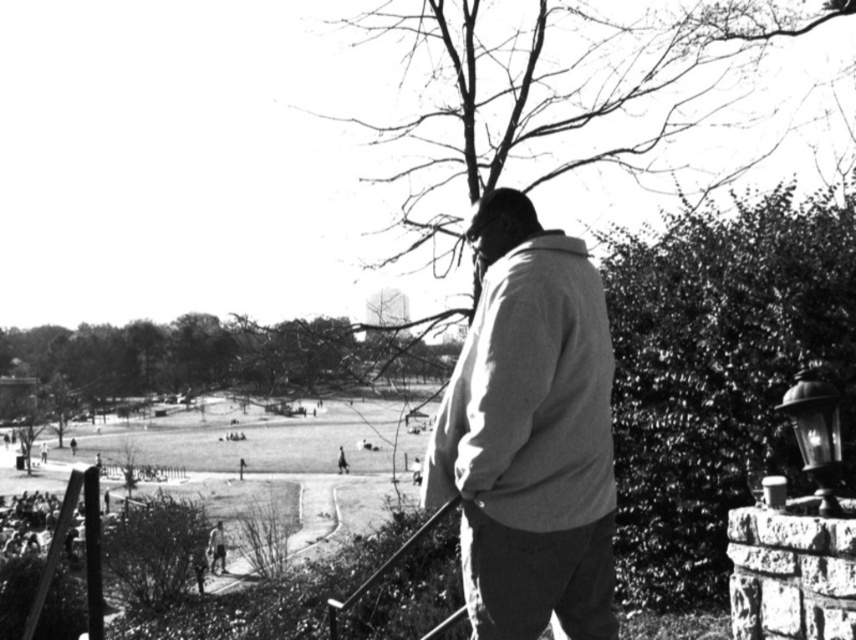
Between point (562, 266) and point (421, 536), which one is positioned in front?

Positioned in front is point (562, 266).

Consider the image. Does light gray cotton jacket at center come in front of smooth metal rail at lower center?

Yes, light gray cotton jacket at center is in front of smooth metal rail at lower center.

Identify the location of light gray cotton jacket at center. The image size is (856, 640). (530, 435).

Can you confirm if smooth metal rail at lower center is smaller than smooth beige jacket at lower center?

Actually, smooth metal rail at lower center might be larger than smooth beige jacket at lower center.

Is point (414, 531) farther from viewer compared to point (223, 532)?

No, it is in front of (223, 532).

Find the location of `smooth metal rail at lower center`. smooth metal rail at lower center is located at coordinates (384, 566).

Which is more to the left, light gray cotton jacket at center or smooth beige jacket at lower center?

smooth beige jacket at lower center is more to the left.

Does light gray cotton jacket at center have a greater width compared to smooth beige jacket at lower center?

Indeed, light gray cotton jacket at center has a greater width compared to smooth beige jacket at lower center.

Find the location of a particular element. The image size is (856, 640). light gray cotton jacket at center is located at coordinates (530, 435).